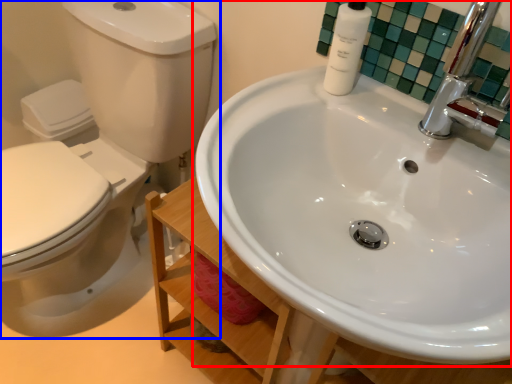
Question: Which point is further to the camera, sink (highlighted by a red box) or toilet (highlighted by a blue box)?

Choices:
 (A) sink
 (B) toilet

Answer: (B)